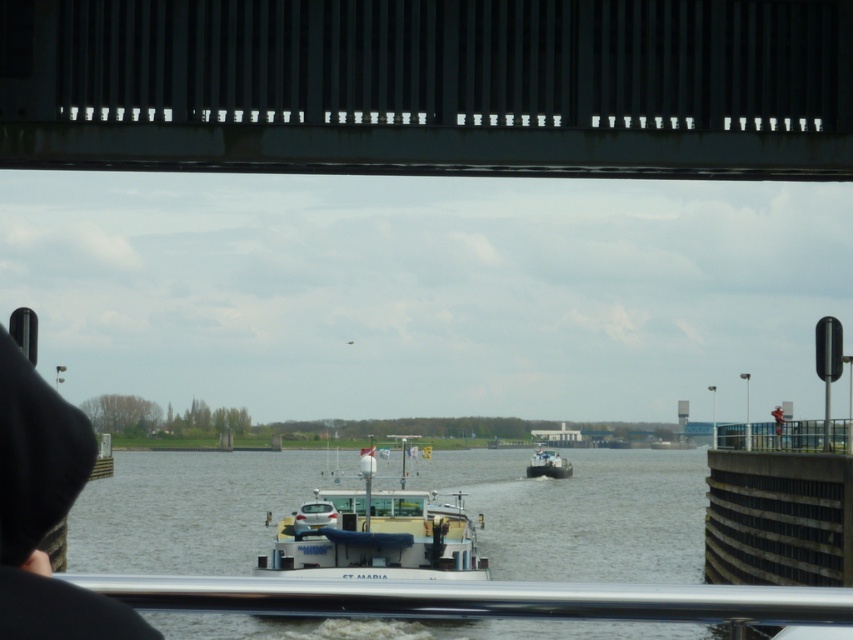
Can you confirm if white matte barge at center is shorter than white matte boat at center?

No.

Does white matte barge at center have a lesser width compared to white matte boat at center?

Incorrect, white matte barge at center's width is not less than white matte boat at center's.

Find the location of `white matte barge at center`. white matte barge at center is located at coordinates (376, 531).

Who is taller, silver metallic rail at lower center or white matte barge at center?

white matte barge at center

Can you confirm if silver metallic rail at lower center is smaller than white matte barge at center?

Yes.

Which is behind, point (287, 596) or point (438, 493)?

The point (438, 493) is behind.

Identify the location of silver metallic rail at lower center. Image resolution: width=853 pixels, height=640 pixels. (479, 598).

Is point (827, 4) closer to viewer compared to point (405, 456)?

Yes, point (827, 4) is closer to viewer.

Can you confirm if smooth concrete bridge at upper center is positioned to the left of white matte barge at center?

No, smooth concrete bridge at upper center is not to the left of white matte barge at center.

This screenshot has height=640, width=853. Find the location of `smooth concrete bridge at upper center`. smooth concrete bridge at upper center is located at coordinates (430, 86).

Image resolution: width=853 pixels, height=640 pixels. I want to click on smooth concrete bridge at upper center, so click(430, 86).